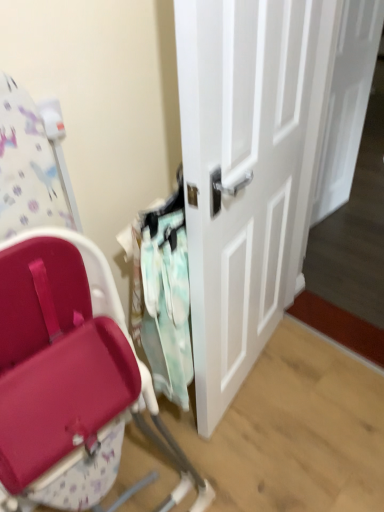
Question: Considering the relative sizes of mint fabric laundry at center and white glossy door at center, which is the first door from left to right, in the image provided, is mint fabric laundry at center bigger than white glossy door at center, which is the first door from left to right,?

Choices:
 (A) no
 (B) yes

Answer: (A)

Question: Is white glossy door at center, the second door positioned from the back, at the back of mint fabric laundry at center?

Choices:
 (A) no
 (B) yes

Answer: (A)

Question: From the image's perspective, is mint fabric laundry at center on top of white glossy door at center, the second door positioned from the back?

Choices:
 (A) yes
 (B) no

Answer: (B)

Question: Can you confirm if mint fabric laundry at center is positioned to the left of white glossy door at center, the second door positioned from the back?

Choices:
 (A) no
 (B) yes

Answer: (B)

Question: From a real-world perspective, is mint fabric laundry at center under white glossy door at center, which ranks as the second door in right-to-left order?

Choices:
 (A) no
 (B) yes

Answer: (B)

Question: Is white glossy door at center, which ranks as the second door in right-to-left order, taller or shorter than white glossy door at center, which is the 1th door in right-to-left order?

Choices:
 (A) tall
 (B) short

Answer: (A)

Question: In the image, is white glossy door at center, arranged as the first door when viewed from the front, positioned in front of or behind white glossy door at center, the second door positioned from the front?

Choices:
 (A) front
 (B) behind

Answer: (A)

Question: From a real-world perspective, is white glossy door at center, which ranks as the second door in right-to-left order, physically located above or below white glossy door at center, the second door positioned from the front?

Choices:
 (A) below
 (B) above

Answer: (B)

Question: Does point (198, 421) appear closer or farther from the camera than point (354, 71)?

Choices:
 (A) closer
 (B) farther

Answer: (A)

Question: Choose the correct answer: Is mint fabric laundry at center inside white glossy door at center, arranged as the 2th door when viewed from the left, or outside it?

Choices:
 (A) outside
 (B) inside

Answer: (A)

Question: Considering their positions, is mint fabric laundry at center located in front of or behind white glossy door at center, arranged as the 1th door when viewed from the back?

Choices:
 (A) behind
 (B) front

Answer: (B)

Question: Is mint fabric laundry at center wider or thinner than white glossy door at center, the second door positioned from the front?

Choices:
 (A) thin
 (B) wide

Answer: (B)

Question: Based on their sizes in the image, would you say mint fabric laundry at center is bigger or smaller than white glossy door at center, the second door positioned from the front?

Choices:
 (A) small
 (B) big

Answer: (A)

Question: Which is correct: white glossy door at center, which is the 1th door in right-to-left order, is inside mint fabric laundry at center, or outside of it?

Choices:
 (A) inside
 (B) outside

Answer: (B)

Question: Considering the positions of white glossy door at center, which is the 1th door in right-to-left order, and mint fabric laundry at center in the image, is white glossy door at center, which is the 1th door in right-to-left order, taller or shorter than mint fabric laundry at center?

Choices:
 (A) short
 (B) tall

Answer: (B)